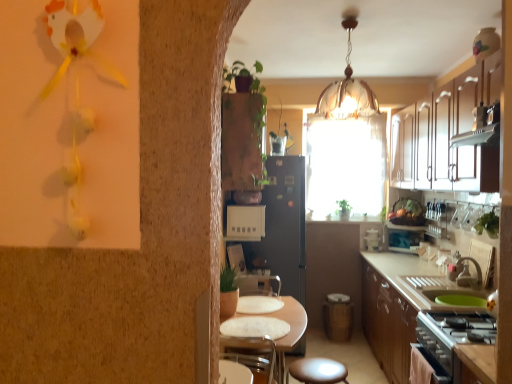
Locate an element on the screen. The image size is (512, 384). blank space situated above white textured table at center (from a real-world perspective) is located at coordinates (259, 317).